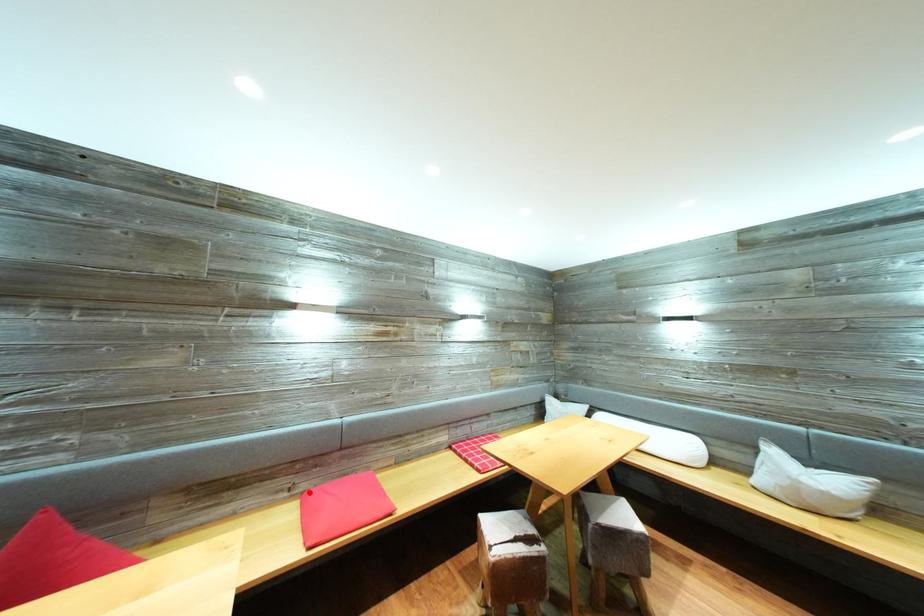
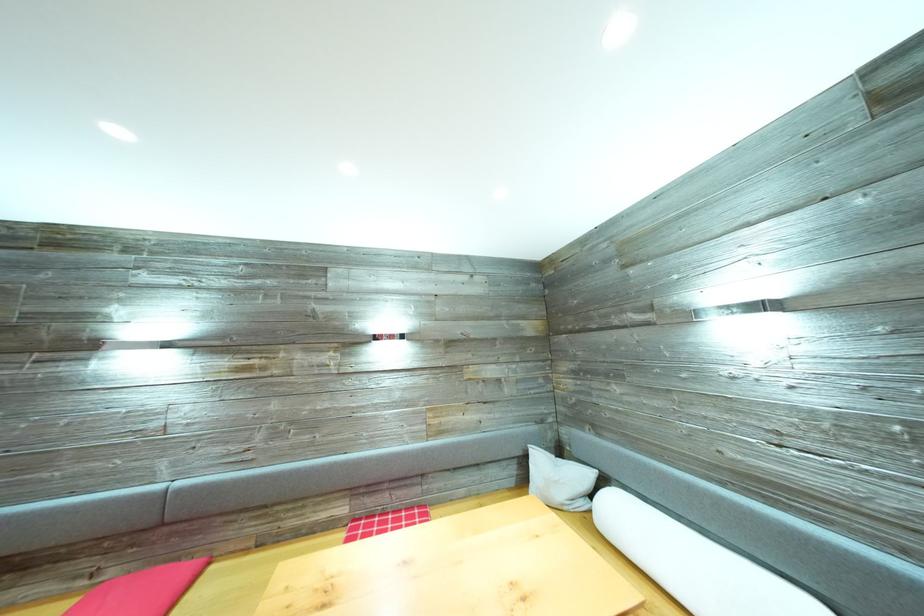
Question: A red point is marked in image1. In image2, is the corresponding 3D point closer to the camera or farther? Reply with the corresponding letter.

Choices:
 (A) The corresponding 3D point is closer.
 (B) The corresponding 3D point is farther.

Answer: (A)